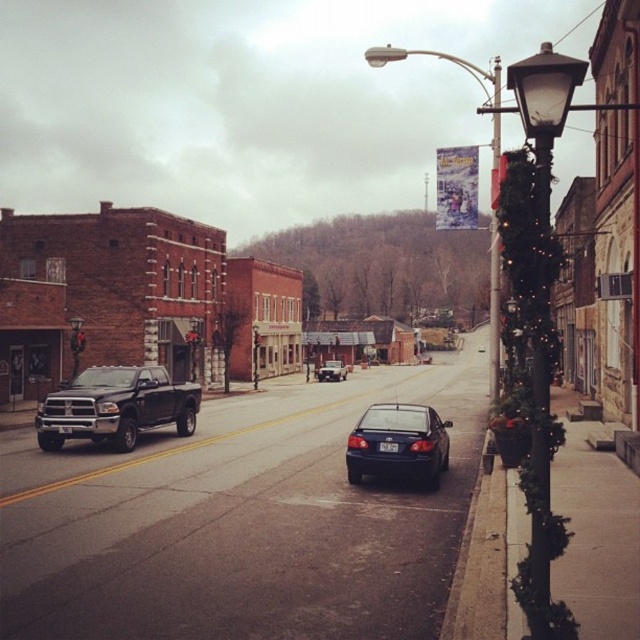
Does black glass lamp post at right have a greater width compared to matte blue sedan at center?

Yes.

Between black glass lamp post at right and matte blue sedan at center, which one has more height?

black glass lamp post at right

Is point (538, 113) positioned after point (380, 468)?

No.

I want to click on black glass lamp post at right, so click(x=545, y=109).

This screenshot has width=640, height=640. I want to click on matte black truck at left, so pyautogui.click(x=115, y=406).

Describe the element at coordinates (115, 406) in the screenshot. The image size is (640, 640). I see `matte black truck at left` at that location.

At what (x,y) coordinates should I click in order to perform the action: click on matte black truck at left. Please return your answer as a coordinate pair (x, y). This screenshot has width=640, height=640. Looking at the image, I should click on (115, 406).

Between point (92, 428) and point (328, 380), which one is positioned behind?

Positioned behind is point (328, 380).

Who is lower down, matte black truck at left or shiny silver sedan at center?

Positioned lower is shiny silver sedan at center.

Image resolution: width=640 pixels, height=640 pixels. What do you see at coordinates (115, 406) in the screenshot? I see `matte black truck at left` at bounding box center [115, 406].

Locate an element on the screen. This screenshot has width=640, height=640. matte black truck at left is located at coordinates (115, 406).